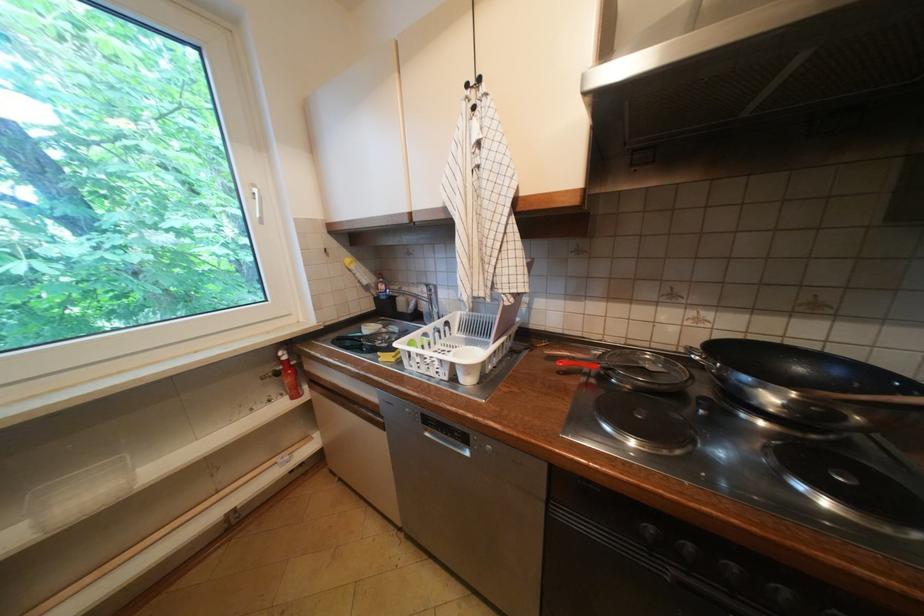
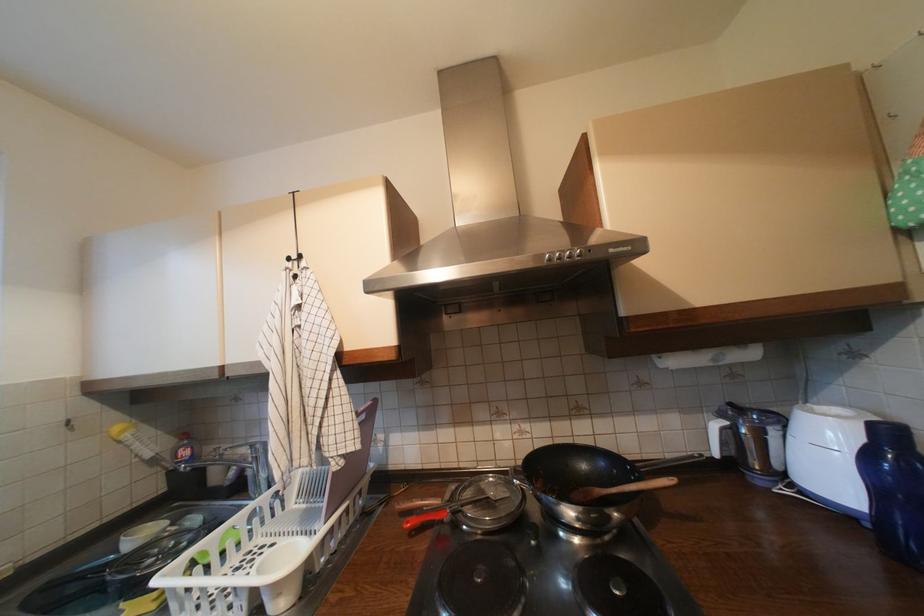
Find the pixel in the second image that matches pixel 403 289 in the first image.

(217, 450)